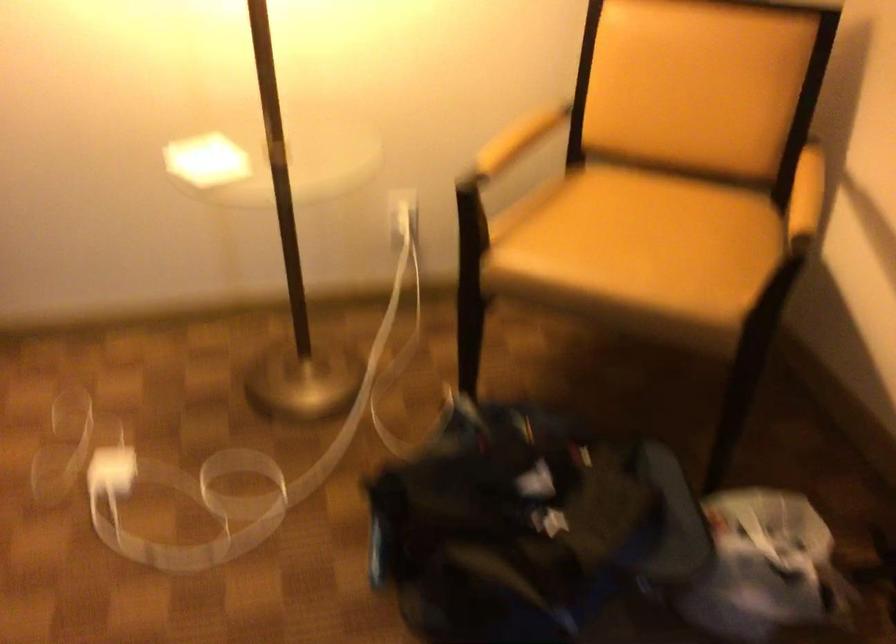
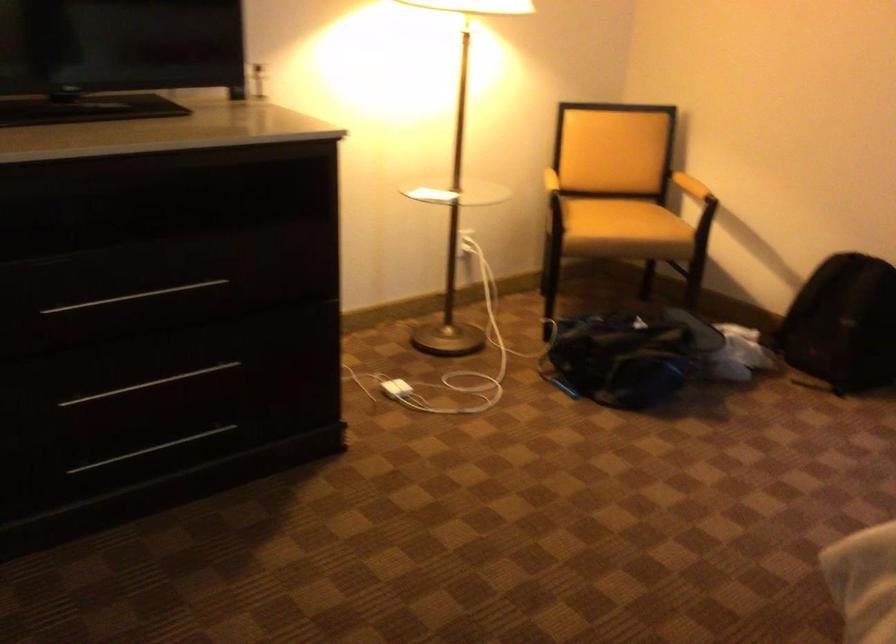
Find the pixel in the second image that matches (795,212) in the first image.

(690, 185)